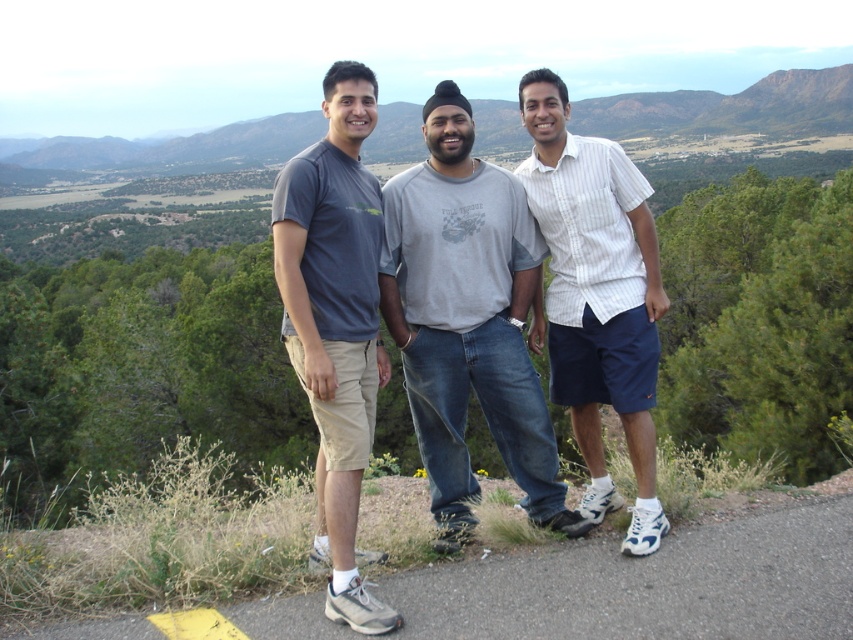
Question: Is white striped shirt at center bigger than matte gray t-shirt at left?

Choices:
 (A) no
 (B) yes

Answer: (A)

Question: Does white striped shirt at center appear over matte gray t-shirt at left?

Choices:
 (A) yes
 (B) no

Answer: (A)

Question: Which object is farther from the camera taking this photo?

Choices:
 (A) matte gray t-shirt at left
 (B) gray cotton t-shirt at center
 (C) white striped shirt at center

Answer: (B)

Question: Can you confirm if gray cotton t-shirt at center is bigger than white striped shirt at center?

Choices:
 (A) yes
 (B) no

Answer: (B)

Question: Which point is closer to the camera?

Choices:
 (A) (310, 179)
 (B) (556, 364)
 (C) (486, 376)

Answer: (A)

Question: Considering the real-world distances, which object is closest to the white striped shirt at center?

Choices:
 (A) gray cotton t-shirt at center
 (B) matte gray t-shirt at left

Answer: (A)